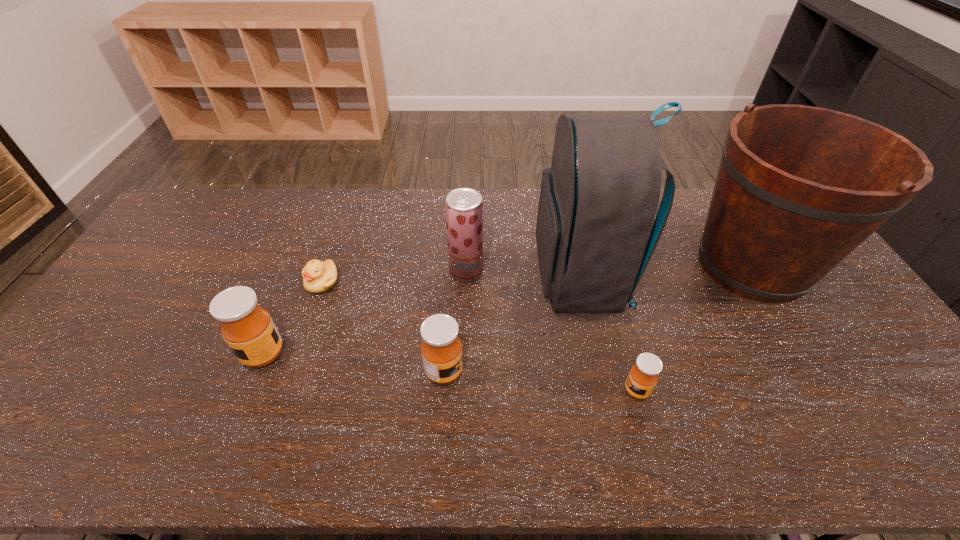
Locate an element on the screen. The height and width of the screenshot is (540, 960). vacant region located on the front-facing side of the leftmost honey is located at coordinates (132, 354).

Where is `vacant space located 0.060m on the front-facing side of the leftmost honey`? vacant space located 0.060m on the front-facing side of the leftmost honey is located at coordinates (219, 354).

Find the location of a particular element. The height and width of the screenshot is (540, 960). vacant space situated on the front-facing side of the leftmost honey is located at coordinates (151, 354).

Locate an element on the screen. This screenshot has width=960, height=540. blank area located 0.280m on the front-facing side of the second honey from right to left is located at coordinates (573, 372).

The width and height of the screenshot is (960, 540). I want to click on free spot located on the front-facing side of the shortest honey, so click(506, 390).

Where is `free space located on the front-facing side of the shortest honey`? free space located on the front-facing side of the shortest honey is located at coordinates point(551,390).

Find the location of a particular element. The height and width of the screenshot is (540, 960). vacant space located 0.110m on the front-facing side of the shortest honey is located at coordinates (579, 390).

At what (x,y) coordinates should I click in order to perform the action: click on blank space located on the front of the rightmost object. Please return your answer as a coordinate pair (x, y). Looking at the image, I should click on (807, 356).

At what (x,y) coordinates should I click in order to perform the action: click on vacant space located 0.060m on the beak of the shortest object. Please return your answer as a coordinate pair (x, y). Looking at the image, I should click on (312, 311).

The width and height of the screenshot is (960, 540). Find the location of `vacant region located on the front-facing side of the tallest object`. vacant region located on the front-facing side of the tallest object is located at coordinates (468, 280).